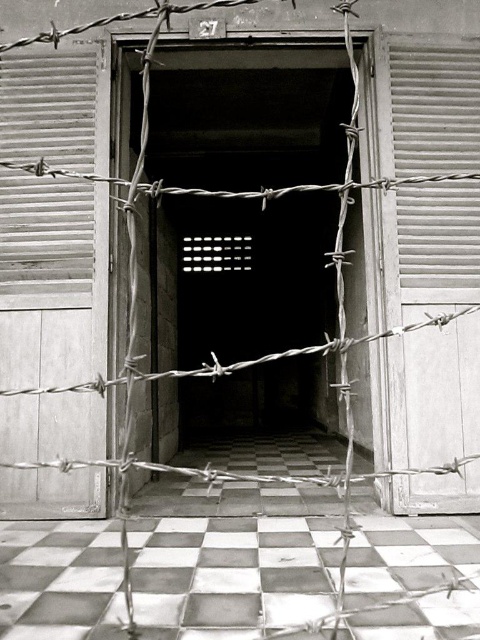
Question: Can you confirm if metallic corrugated door at right is wider than white wooden shutter at right?

Choices:
 (A) no
 (B) yes

Answer: (B)

Question: Can you confirm if metallic corrugated door at right is positioned to the left of white wooden shutter at right?

Choices:
 (A) no
 (B) yes

Answer: (B)

Question: Among these objects, which one is nearest to the camera?

Choices:
 (A) white wooden shutter at right
 (B) metallic corrugated door at right
 (C) metallic corrugated shutter at left

Answer: (B)

Question: Which object is closer to the camera taking this photo?

Choices:
 (A) metallic corrugated shutter at left
 (B) metallic corrugated door at right

Answer: (B)

Question: In this image, where is metallic corrugated door at right located relative to white wooden shutter at right?

Choices:
 (A) right
 (B) left

Answer: (B)

Question: Estimate the real-world distances between objects in this image. Which object is closer to the metallic corrugated shutter at left?

Choices:
 (A) white wooden shutter at right
 (B) metallic corrugated door at right

Answer: (B)